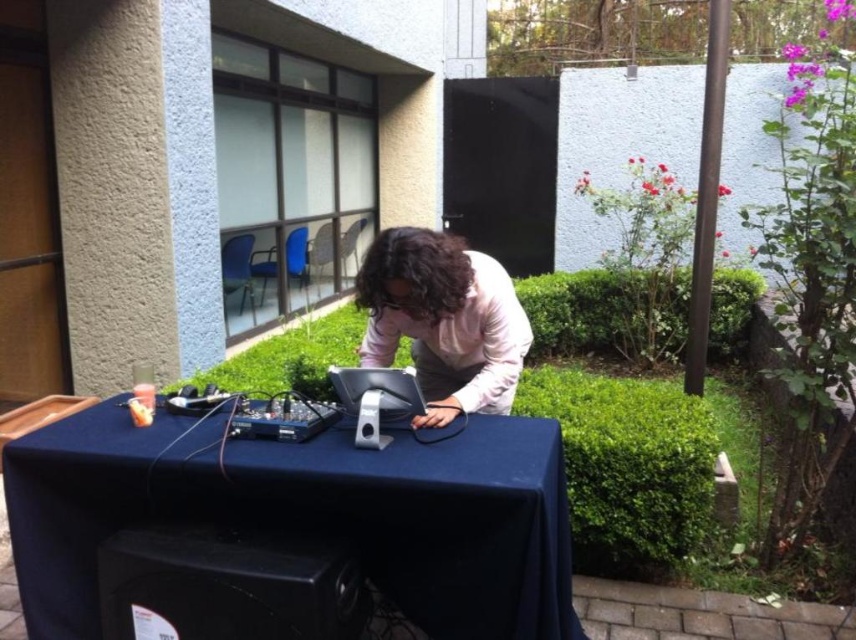
You are setting up a presentation and need to know which item on the table takes up more horizontal space. Which is wider, the black plastic speaker at lower center or the pink matte shirt at center?

The black plastic speaker at lower center is wider than the pink matte shirt at center according to their widths.

You are a photographer setting up for an event. You need to place a camera on the surface that is higher between the blue fabric table at center and the black plastic speaker at lower center. Which surface should you choose?

The blue fabric table at center is above the black plastic speaker at lower center, so you should place the camera on the blue fabric table at center since it is higher.

You are setting up a small audio system for a presentation. You have a blue fabric table at center and a black plastic speaker at lower center. Which object should you place the main audio equipment on to ensure stability?

The blue fabric table at center is larger in size than the black plastic speaker at lower center, so you should place the main audio equipment on the blue fabric table at center for better stability.